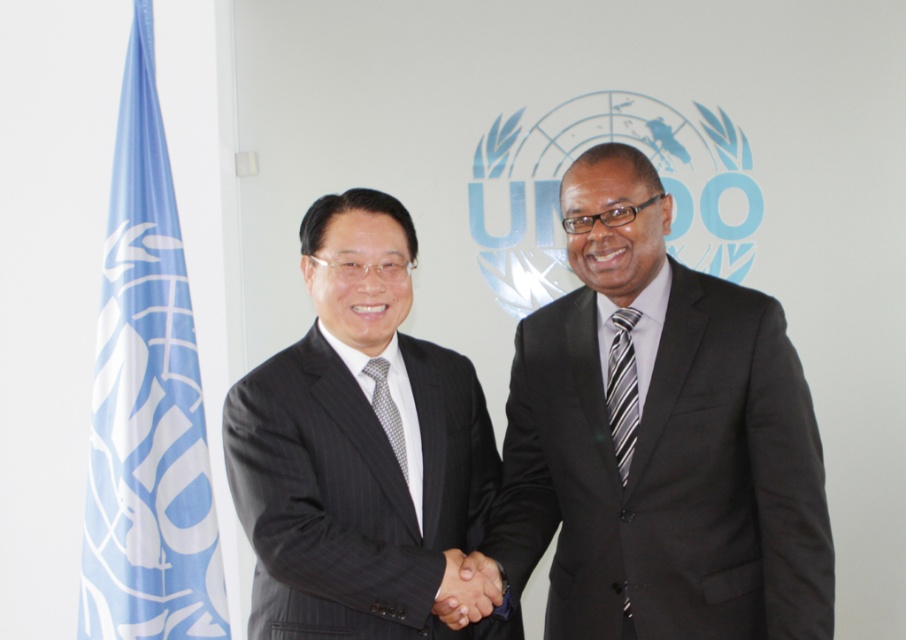
You are a photographer at a UN event. You notice the matte black suit at center and the striped fabric tie at center. Which object is closer to the camera?

The matte black suit at center is closer to the camera than the striped fabric tie at center because it is in front of it.

You are standing in front of the black suit at center and want to shake hands with the person wearing it. What is the minimum distance you need to move forward to reach them?

The black suit at center and viewer are 1.68 meters apart from each other, so you need to move forward at least 1.68 meters to reach them.

You are attending a UN event and need to identify the largest object between the black suit at center and the blue fabric flag at left. Which one is bigger?

The black suit at center has a larger size compared to the blue fabric flag at left, so the black suit at center is bigger.